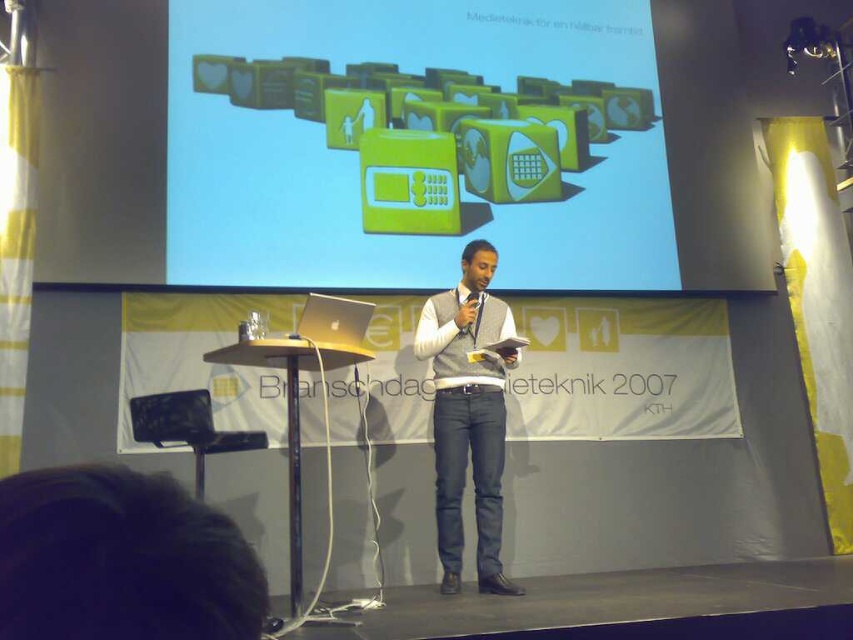
You are an event organizer who needs to ensure the speaker is properly positioned for the camera. The camera is focused on the center of the stage. Which object, the gray sweater vest at center or the black plastic microphone at center, is closer to the camera?

The gray sweater vest at center is positioned on the left side of the black plastic microphone at center, so the microphone is closer to the camera since it is at the center point.

You are an attendee at the presentation. You notice the gray sweater vest at center and the green glossy microwave at upper center. Which object is closer to you from your seat in the audience?

The green glossy microwave at upper center is closer to you because the gray sweater vest at center is positioned behind it.

You are a stagehand who needs to adjust the position of the green glossy microwave at upper center so that it is closer to the speaker. How much distance should you reduce between them to make them 2.5 meters apart?

The current distance between the green glossy microwave at upper center and the speaker is 4.02 meters. To reduce it to 2.5 meters, the stagehand should move the microwave closer by 1.52 meters.